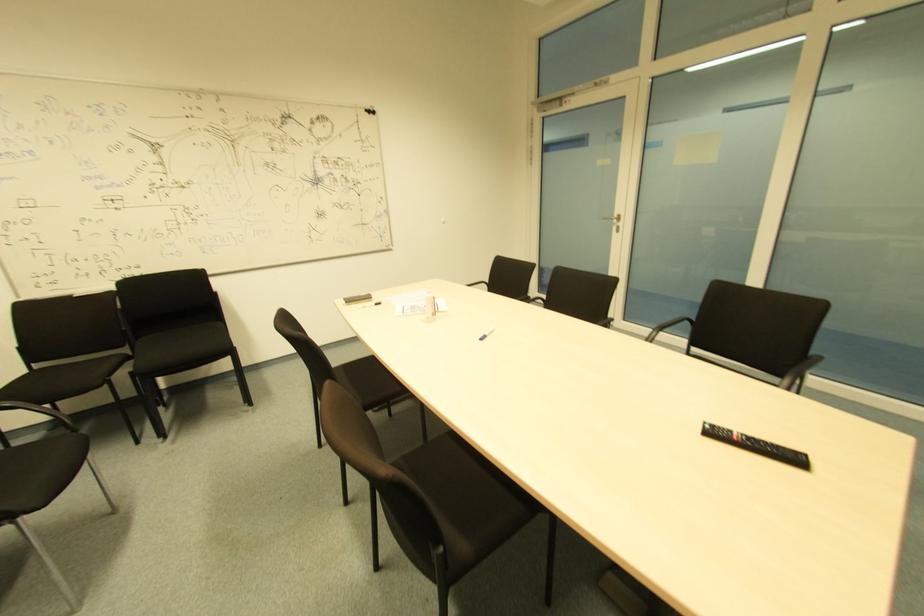
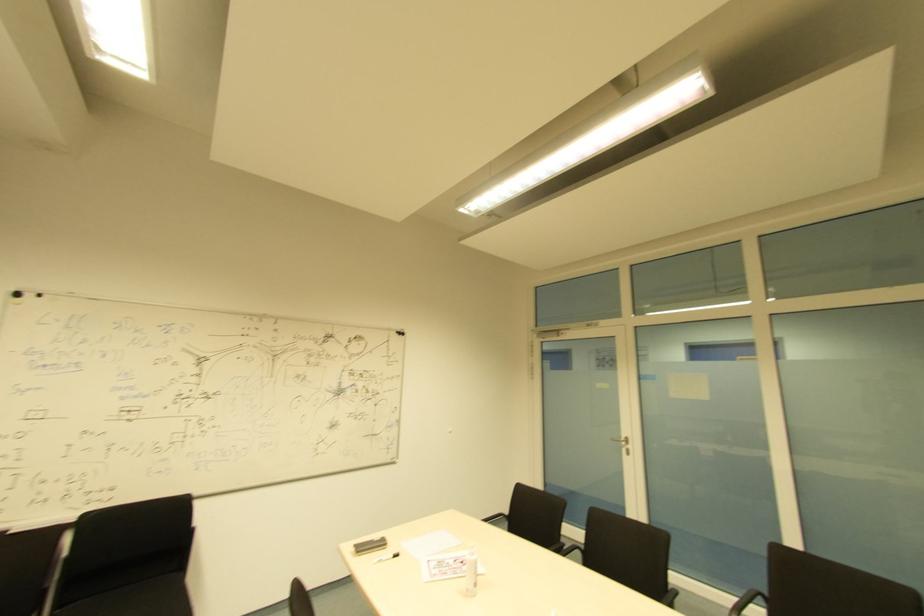
The point at (412, 313) is marked in the first image. Where is the corresponding point in the second image?

(444, 572)